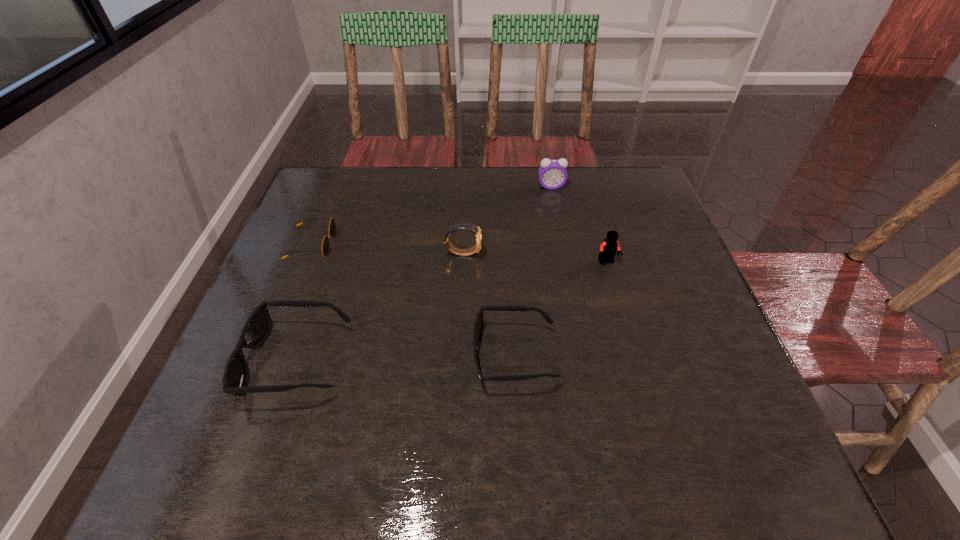
Identify the location of vacant region located on the front-facing side of the second shortest object. (444, 356).

Where is `vacant region located 0.110m on the front-facing side of the second shortest object`? Image resolution: width=960 pixels, height=540 pixels. vacant region located 0.110m on the front-facing side of the second shortest object is located at coordinates (420, 356).

Identify the location of vacant area situated 0.110m on the face of the alarm clock. The height and width of the screenshot is (540, 960). (556, 213).

At what (x,y) coordinates should I click in order to perform the action: click on vacant space located 0.150m on the front-facing side of the shortest object. Please return your answer as a coordinate pair (x, y). Looking at the image, I should click on (391, 244).

The height and width of the screenshot is (540, 960). Find the location of `vacant space located 0.250m on the face of the watch`. vacant space located 0.250m on the face of the watch is located at coordinates pos(580,253).

This screenshot has width=960, height=540. I want to click on vacant space located on the front-facing side of the Lego, so click(624, 322).

Locate an element on the screen. object present at the far edge is located at coordinates (552, 173).

I want to click on object situated at the right edge, so click(608, 249).

What are the coordinates of `object at the near left corner` in the screenshot? It's located at (256, 329).

Locate an element on the screen. This screenshot has width=960, height=540. vacant space at the far edge is located at coordinates (587, 176).